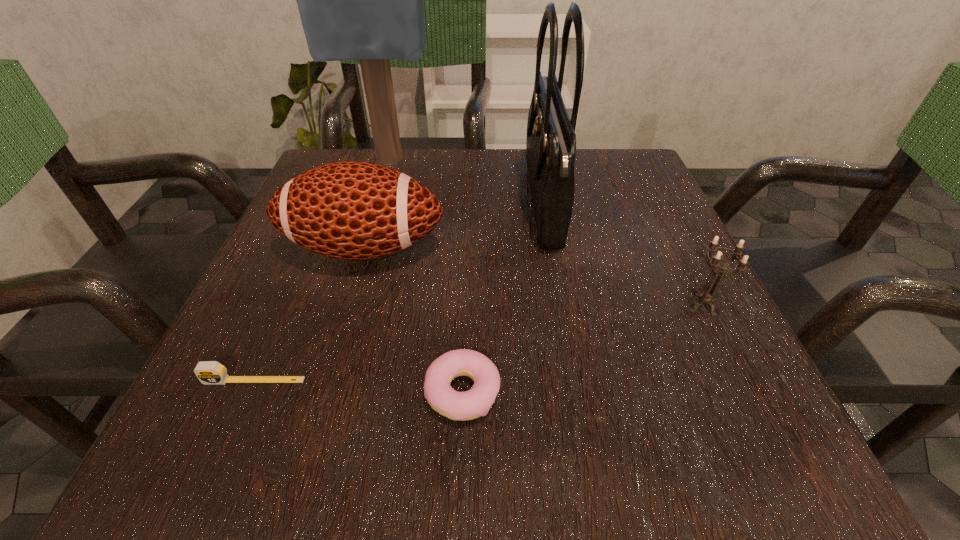
Locate an element on the screen. tape measure that is at the left edge is located at coordinates (208, 372).

Locate an element on the screen. This screenshot has width=960, height=540. object present at the right edge is located at coordinates (707, 298).

Find the location of `object positioned at the far left corner`. object positioned at the far left corner is located at coordinates (363, 0).

You are a GUI agent. You are given a task and a screenshot of the screen. Output one action in this format:
    pyautogui.click(x=<x>, y=<y>)
    Task: Click on the free region at the far edge of the desktop
    This screenshot has height=540, width=960.
    Given the screenshot: What is the action you would take?
    pyautogui.click(x=465, y=153)

Where is `vacant area at the left edge`? vacant area at the left edge is located at coordinates (325, 308).

The height and width of the screenshot is (540, 960). Find the location of `free location at the right edge of the desktop`. free location at the right edge of the desktop is located at coordinates (717, 393).

Where is `vacant region at the far left corner of the desktop`? This screenshot has width=960, height=540. vacant region at the far left corner of the desktop is located at coordinates point(345,161).

Where is `vacant space at the near left corner`? This screenshot has height=540, width=960. vacant space at the near left corner is located at coordinates (264, 451).

This screenshot has height=540, width=960. In the image, there is a desktop. Find the location of `free space at the far right corner`. free space at the far right corner is located at coordinates (610, 178).

Identify the location of vacant space that's between the handbag and the third tallest object. (453, 226).